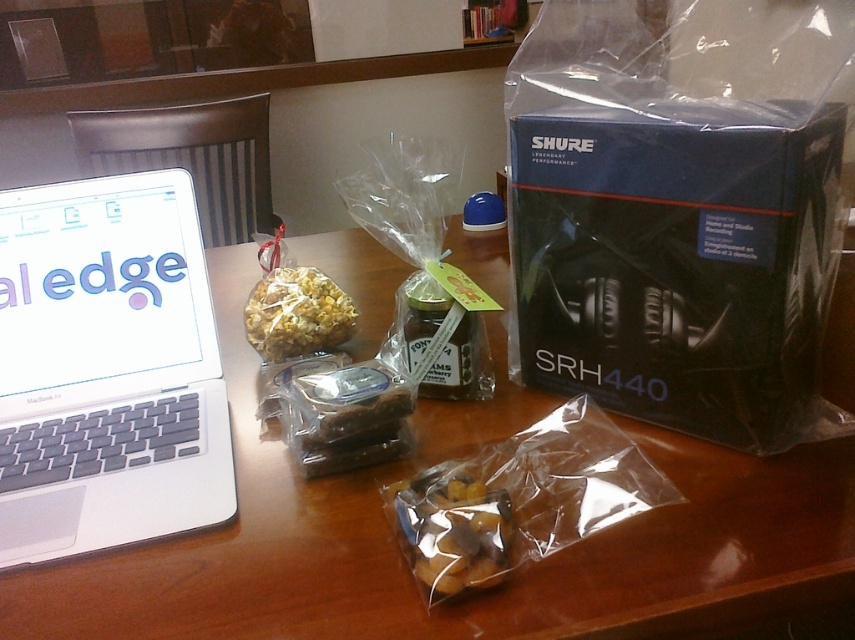
You are a drone operator trying to navigate between two points on a desk. You have to fly from point A to point B. If point A is at point [351,550] and point B is at point [741,330], which point is closer to your starting position at the camera?

Point [351,550] is closer to the camera than point [741,330], so you should start at point A since it is closer to your starting position at the camera.

You are standing at the edge of the desk and want to place a new item on the wooden table at center. Based on its current position, where exactly should you place the item?

The wooden table at center is located at point (404, 564), so you should place the new item at that coordinate to ensure it lands precisely on the wooden table at center.

You are organizing items on a wooden desk and notice the wooden table at center and the shiny popcorn at center. Which object is positioned lower on the desk?

The wooden table at center is positioned lower than the shiny popcorn at center according to the description.